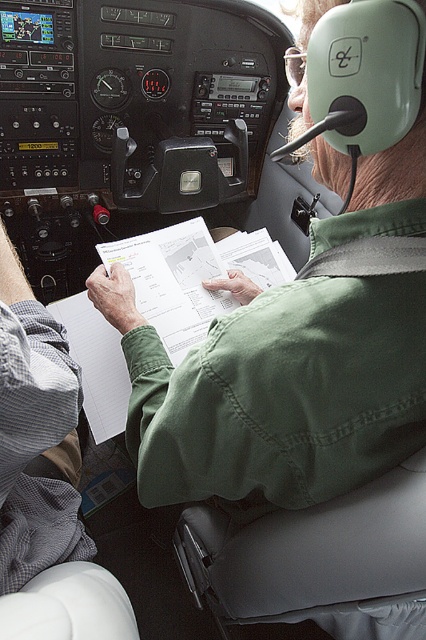
You are a passenger in the aircraft cockpit and need to locate the point at coordinates (275, 390). According to the scene description, where would this point be located?

The point at coordinates (275, 390) is on the green cotton shirt at center.

You are a passenger in the aircraft and want to know if the green cotton shirt at center can be fully covered by the white paper at center. Can it?

The green cotton shirt at center has a lesser width compared to white paper at center, so the white paper at center can fully cover the green cotton shirt at center.